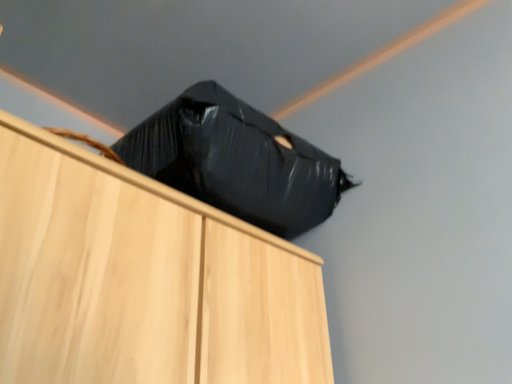
This screenshot has width=512, height=384. Find the location of `black plastic bag at upper center`. black plastic bag at upper center is located at coordinates (236, 161).

What do you see at coordinates (236, 161) in the screenshot?
I see `black plastic bag at upper center` at bounding box center [236, 161].

The height and width of the screenshot is (384, 512). In order to click on black plastic bag at upper center in this screenshot , I will do `click(236, 161)`.